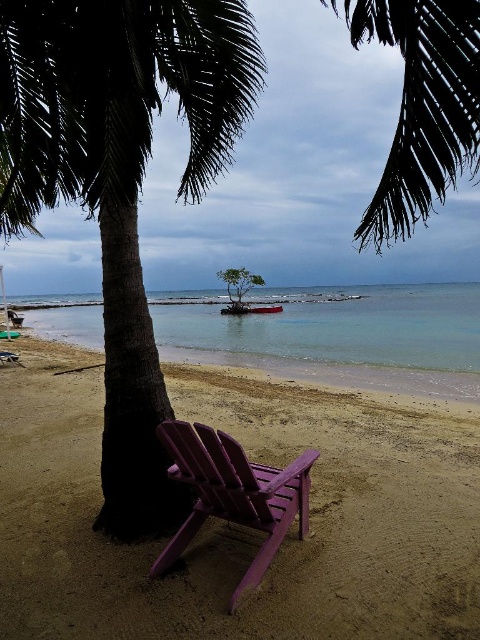
Question: Which point appears closest to the camera in this image?

Choices:
 (A) (230, 308)
 (B) (335, 634)

Answer: (B)

Question: Estimate the real-world distances between objects in this image. Which object is closer to the silhouette leafy palm at upper center?

Choices:
 (A) dark green leafy palm tree at center
 (B) sandy brown at lower center
 (C) clear blue water at center
 (D) green leafy tree at center

Answer: (C)

Question: Does clear blue water at center have a greater width compared to wooden boat at center?

Choices:
 (A) yes
 (B) no

Answer: (A)

Question: Is sandy brown at lower center bigger than silhouette leafy palm at upper center?

Choices:
 (A) yes
 (B) no

Answer: (B)

Question: Does clear blue water at center have a smaller size compared to purple wood beach chair at lower center?

Choices:
 (A) no
 (B) yes

Answer: (A)

Question: Based on their relative distances, which object is nearer to the green leafy tree at center?

Choices:
 (A) purple wood beach chair at lower center
 (B) silhouette leafy palm at upper center
 (C) sandy brown at lower center

Answer: (B)